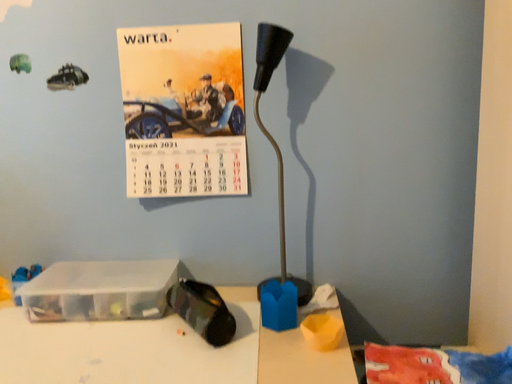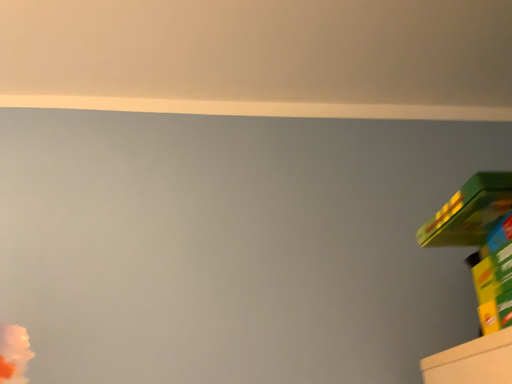
Question: How did the camera likely rotate when shooting the video?

Choices:
 (A) rotated upward
 (B) rotated downward

Answer: (A)